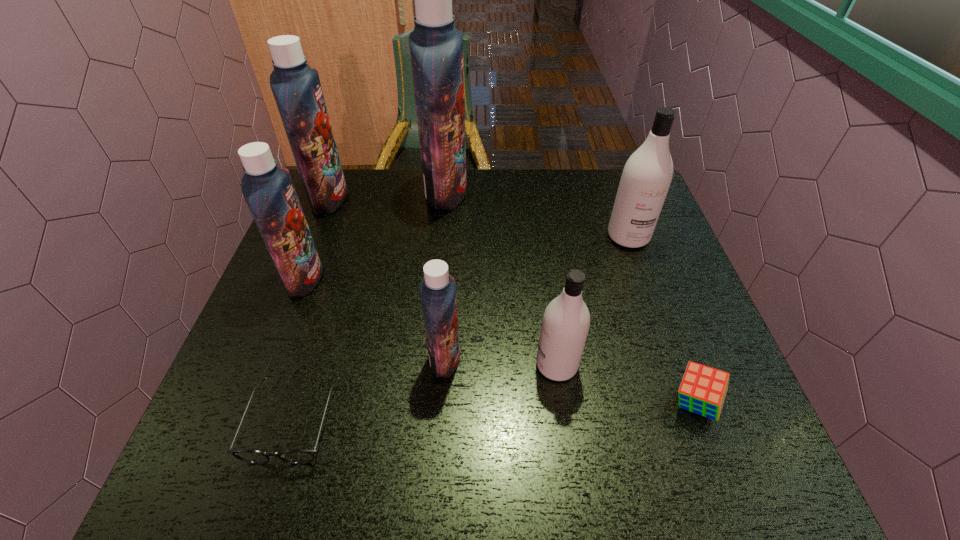
The height and width of the screenshot is (540, 960). In order to click on free space located 0.250m on the front-facing side of the nearer white shampoo in this screenshot , I will do `click(417, 365)`.

Identify the location of free space located on the front-facing side of the nearer white shampoo. (484, 365).

Locate an element on the screen. vacant area situated on the front-facing side of the nearer white shampoo is located at coordinates (445, 365).

You are a GUI agent. You are given a task and a screenshot of the screen. Output one action in this format:
    pyautogui.click(x=<x>, y=<y>)
    Task: Click on the free space located 0.400m on the back of the second shortest object
    This screenshot has width=960, height=540.
    Given the screenshot: What is the action you would take?
    pyautogui.click(x=638, y=249)

Find the location of a particular element. Image resolution: width=960 pixels, height=540 pixels. object positioned at the near edge is located at coordinates (298, 456).

What are the coordinates of `spectacles that is at the left edge` in the screenshot? It's located at (298, 456).

I want to click on shampoo that is at the right edge, so click(647, 175).

Image resolution: width=960 pixels, height=540 pixels. I want to click on cube present at the right edge, so click(x=703, y=389).

At what (x,y) coordinates should I click in order to perform the action: click on object that is at the far left corner. Please return your answer as a coordinate pair (x, y). This screenshot has width=960, height=540. Looking at the image, I should click on (296, 87).

Identify the location of object located at the near left corner. point(298,456).